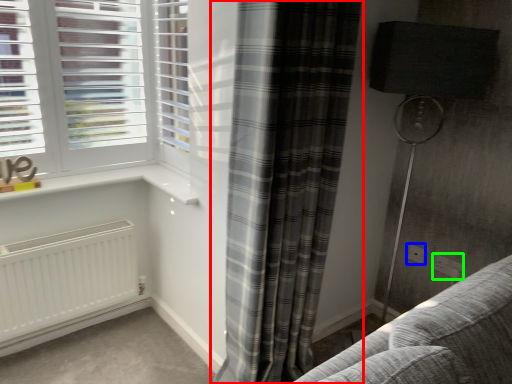
Question: Estimate the real-world distances between objects in this image. Which object is farther from curtain (highlighted by a red box), electric outlet (highlighted by a blue box) or electric outlet (highlighted by a green box)?

Choices:
 (A) electric outlet
 (B) electric outlet

Answer: (B)